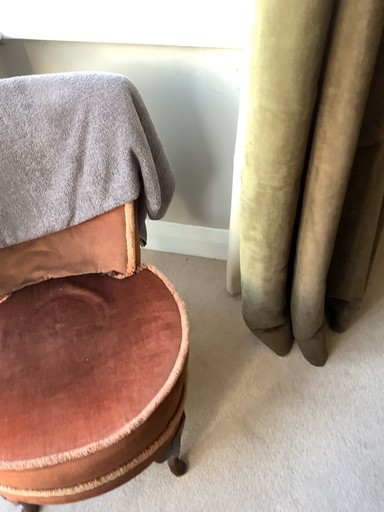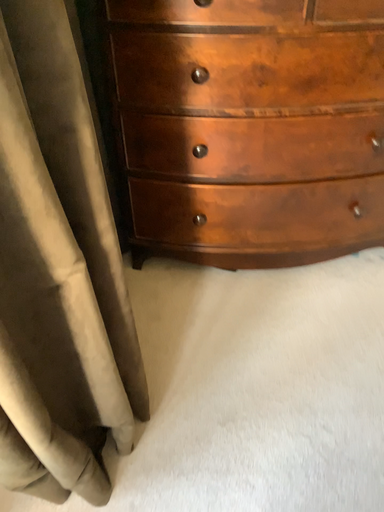
Question: Which way did the camera rotate in the video?

Choices:
 (A) rotated upward
 (B) rotated downward

Answer: (A)